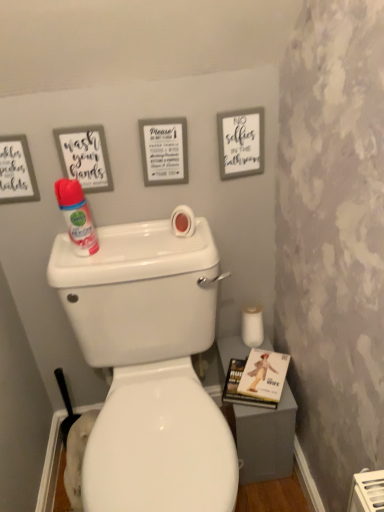
How much space does white matte toilet paper at lower right, which is counted as the 1th toilet paper, starting from the back, occupy vertically?

It is 13.64 centimeters.

Measure the distance between point (x=76, y=242) and camera.

A distance of 1.11 meters exists between point (x=76, y=242) and camera.

You are a GUI agent. You are given a task and a screenshot of the screen. Output one action in this format:
    pyautogui.click(x=<x>, y=<y>)
    Task: Click on the white matte sign at upper right, the first picture frame viewed from the right
    The width and height of the screenshot is (384, 512).
    Given the screenshot: What is the action you would take?
    pyautogui.click(x=241, y=143)

This screenshot has height=512, width=384. Describe the element at coordinates (256, 379) in the screenshot. I see `hardcover book at lower right` at that location.

Measure the distance between point (146, 157) and camera.

They are 3.68 feet apart.

This screenshot has height=512, width=384. I want to click on white matte toilet paper at lower right, the 1th toilet paper ordered from the bottom, so click(252, 326).

Between point (155, 179) and point (249, 149), which one is positioned in front?

The point (249, 149) is closer to the camera.

Can you see matte white sign at upper center, which is the second picture frame from right to left, touching white matte sign at upper right, the 3th picture frame positioned from the left?

matte white sign at upper center, which is the second picture frame from right to left, and white matte sign at upper right, the 3th picture frame positioned from the left, are not in contact.

Considering the relative sizes of matte white sign at upper center, arranged as the second picture frame when viewed from the left, and white matte sign at upper right, the first picture frame viewed from the right, in the image provided, is matte white sign at upper center, arranged as the second picture frame when viewed from the left, bigger than white matte sign at upper right, the first picture frame viewed from the right,?

Yes, matte white sign at upper center, arranged as the second picture frame when viewed from the left, is bigger than white matte sign at upper right, the first picture frame viewed from the right.

How many degrees apart are the facing directions of matte white sign at upper center, which is the second picture frame from right to left, and white matte sign at upper right, the first picture frame viewed from the right?

The facing directions of matte white sign at upper center, which is the second picture frame from right to left, and white matte sign at upper right, the first picture frame viewed from the right, are 0.133 degrees apart.

Is matte pink spray bottle at left looking in the opposite direction of pink matte toilet paper at upper center, which is counted as the first toilet paper, starting from the front?

No, matte pink spray bottle at left's orientation is not away from pink matte toilet paper at upper center, which is counted as the first toilet paper, starting from the front.

From a real-world perspective, is matte pink spray bottle at left located beneath pink matte toilet paper at upper center, marked as the 2th toilet paper in a right-to-left arrangement?

No, from a real-world perspective, matte pink spray bottle at left is not below pink matte toilet paper at upper center, marked as the 2th toilet paper in a right-to-left arrangement.

Does matte pink spray bottle at left touch pink matte toilet paper at upper center, marked as the second toilet paper in a bottom-to-top arrangement?

No, matte pink spray bottle at left is not touching pink matte toilet paper at upper center, marked as the second toilet paper in a bottom-to-top arrangement.

Considering the relative sizes of matte pink spray bottle at left and pink matte toilet paper at upper center, marked as the second toilet paper in a bottom-to-top arrangement, in the image provided, is matte pink spray bottle at left shorter than pink matte toilet paper at upper center, marked as the second toilet paper in a bottom-to-top arrangement,?

In fact, matte pink spray bottle at left may be taller than pink matte toilet paper at upper center, marked as the second toilet paper in a bottom-to-top arrangement.

Which object is wider, matte gray picture frame at upper left, positioned as the third picture frame in right-to-left order, or matte white sign at upper center, arranged as the second picture frame when viewed from the left?

Wider between the two is matte white sign at upper center, arranged as the second picture frame when viewed from the left.

Between matte gray picture frame at upper left, which appears as the first picture frame when viewed from the left, and matte white sign at upper center, which is the second picture frame from right to left, which one appears on the left side from the viewer's perspective?

From the viewer's perspective, matte gray picture frame at upper left, which appears as the first picture frame when viewed from the left, appears more on the left side.

From a real-world perspective, which is physically below, matte gray picture frame at upper left, which appears as the first picture frame when viewed from the left, or matte white sign at upper center, arranged as the second picture frame when viewed from the left?

matte white sign at upper center, arranged as the second picture frame when viewed from the left, from a real-world perspective.

Which is more to the right, white glossy toilet at center or white matte sign at upper right, the 3th picture frame positioned from the left?

From the viewer's perspective, white matte sign at upper right, the 3th picture frame positioned from the left, appears more on the right side.

From a real-world perspective, is white glossy toilet at center physically below white matte sign at upper right, the 3th picture frame positioned from the left?

Correct, in the physical world, white glossy toilet at center is lower than white matte sign at upper right, the 3th picture frame positioned from the left.

Would you say white glossy toilet at center is outside white matte sign at upper right, the first picture frame viewed from the right?

Yes, white glossy toilet at center is outside of white matte sign at upper right, the first picture frame viewed from the right.

Is white glossy toilet at center positioned far away from white matte sign at upper right, the first picture frame viewed from the right?

No, white glossy toilet at center is not far away from white matte sign at upper right, the first picture frame viewed from the right.

From the image's perspective, is matte white sign at upper center, which is the second picture frame from right to left, above or below pink matte toilet paper at upper center, marked as the 2th toilet paper in a right-to-left arrangement?

matte white sign at upper center, which is the second picture frame from right to left, is situated higher than pink matte toilet paper at upper center, marked as the 2th toilet paper in a right-to-left arrangement, in the image.

Is matte white sign at upper center, which is the second picture frame from right to left, not near pink matte toilet paper at upper center, which is counted as the second toilet paper, starting from the back?

They are positioned close to each other.

Does matte white sign at upper center, arranged as the second picture frame when viewed from the left, have a larger size compared to pink matte toilet paper at upper center, which is counted as the first toilet paper, starting from the front?

Correct, matte white sign at upper center, arranged as the second picture frame when viewed from the left, is larger in size than pink matte toilet paper at upper center, which is counted as the first toilet paper, starting from the front.

Does matte white sign at upper center, which is the second picture frame from right to left, appear on the left side of pink matte toilet paper at upper center, arranged as the 1th toilet paper when viewed from the top?

Correct, you'll find matte white sign at upper center, which is the second picture frame from right to left, to the left of pink matte toilet paper at upper center, arranged as the 1th toilet paper when viewed from the top.

How different are the orientations of white matte toilet paper at lower right, which is counted as the 1th toilet paper, starting from the back, and white matte sign at upper right, the first picture frame viewed from the right, in degrees?

The facing directions of white matte toilet paper at lower right, which is counted as the 1th toilet paper, starting from the back, and white matte sign at upper right, the first picture frame viewed from the right, are 1.58 degrees apart.

Considering the sizes of objects white matte toilet paper at lower right, which appears as the 2th toilet paper when viewed from the left, and white matte sign at upper right, the first picture frame viewed from the right, in the image provided, who is bigger, white matte toilet paper at lower right, which appears as the 2th toilet paper when viewed from the left, or white matte sign at upper right, the first picture frame viewed from the right,?

white matte toilet paper at lower right, which appears as the 2th toilet paper when viewed from the left, is bigger.

From a real-world perspective, which is physically below, white matte toilet paper at lower right, placed as the 1th toilet paper when sorted from right to left, or white matte sign at upper right, the first picture frame viewed from the right?

white matte toilet paper at lower right, placed as the 1th toilet paper when sorted from right to left.

In terms of width, does white matte toilet paper at lower right, placed as the 1th toilet paper when sorted from right to left, look wider or thinner when compared to white matte sign at upper right, the 3th picture frame positioned from the left?

white matte toilet paper at lower right, placed as the 1th toilet paper when sorted from right to left, is wider than white matte sign at upper right, the 3th picture frame positioned from the left.

In the scene shown: From the image's perspective, is matte white sign at upper center, which is the second picture frame from right to left, below white glossy toilet at center?

No, from the image's perspective, matte white sign at upper center, which is the second picture frame from right to left, is not beneath white glossy toilet at center.

Does matte white sign at upper center, arranged as the second picture frame when viewed from the left, have a larger size compared to white glossy toilet at center?

No, matte white sign at upper center, arranged as the second picture frame when viewed from the left, is not bigger than white glossy toilet at center.

Which is in front, matte white sign at upper center, arranged as the second picture frame when viewed from the left, or white glossy toilet at center?

white glossy toilet at center is closer to the camera.

This screenshot has width=384, height=512. In order to click on the 1st picture frame above the white matte sign at upper right, the 3th picture frame positioned from the left (from a real-world perspective) in this screenshot , I will do `click(164, 151)`.

Locate an element on the screen. The image size is (384, 512). cleaning product that is in front of the pink matte toilet paper at upper center, marked as the 2th toilet paper in a right-to-left arrangement is located at coordinates (76, 216).

When comparing their distances from matte gray picture frame at upper left, which appears as the first picture frame when viewed from the left, does hardcover book at lower right or white matte sign at upper right, the 3th picture frame positioned from the left, seem closer?

white matte sign at upper right, the 3th picture frame positioned from the left, is closer to matte gray picture frame at upper left, which appears as the first picture frame when viewed from the left.

Based on their spatial positions, is white matte sign at upper right, the 3th picture frame positioned from the left, or matte gray picture frame at upper left, positioned as the third picture frame in right-to-left order, closer to white matte toilet paper at lower right, the 1th toilet paper ordered from the bottom?

white matte sign at upper right, the 3th picture frame positioned from the left, lies closer to white matte toilet paper at lower right, the 1th toilet paper ordered from the bottom, than the other object.

When comparing their distances from matte white sign at upper center, arranged as the second picture frame when viewed from the left, does white glossy toilet at center or white matte sign at upper right, the 3th picture frame positioned from the left, seem closer?

white matte sign at upper right, the 3th picture frame positioned from the left, is positioned closer to the anchor matte white sign at upper center, arranged as the second picture frame when viewed from the left.

Looking at the image, which one is located further to matte pink spray bottle at left, white matte toilet paper at lower right, which is the second toilet paper in front-to-back order, or matte white sign at upper center, arranged as the second picture frame when viewed from the left?

white matte toilet paper at lower right, which is the second toilet paper in front-to-back order.

Looking at the image, which one is located closer to matte white sign at upper center, which is the second picture frame from right to left, matte gray picture frame at upper left, positioned as the third picture frame in right-to-left order, or white glossy toilet at center?

matte gray picture frame at upper left, positioned as the third picture frame in right-to-left order, lies closer to matte white sign at upper center, which is the second picture frame from right to left, than the other object.

Considering their positions, is matte white sign at upper center, arranged as the second picture frame when viewed from the left, positioned further to hardcover book at lower right than matte pink spray bottle at left?

matte white sign at upper center, arranged as the second picture frame when viewed from the left, is positioned further to the anchor hardcover book at lower right.

Which object lies nearer to the anchor point hardcover book at lower right, white matte toilet paper at lower right, which is counted as the 1th toilet paper, starting from the back, or matte white sign at upper center, arranged as the second picture frame when viewed from the left?

Among the two, white matte toilet paper at lower right, which is counted as the 1th toilet paper, starting from the back, is located nearer to hardcover book at lower right.

Estimate the real-world distances between objects in this image. Which object is closer to hardcover book at lower right, white matte sign at upper right, the first picture frame viewed from the right, or matte gray picture frame at upper left, positioned as the third picture frame in right-to-left order?

white matte sign at upper right, the first picture frame viewed from the right, is positioned closer to the anchor hardcover book at lower right.

Where is `toilet paper that lies between matte gray picture frame at upper left, positioned as the third picture frame in right-to-left order, and white matte toilet paper at lower right, marked as the 2th toilet paper in a top-to-bottom arrangement, from top to bottom`? Image resolution: width=384 pixels, height=512 pixels. toilet paper that lies between matte gray picture frame at upper left, positioned as the third picture frame in right-to-left order, and white matte toilet paper at lower right, marked as the 2th toilet paper in a top-to-bottom arrangement, from top to bottom is located at coordinates (183, 221).

Find the location of `toilet paper located between matte pink spray bottle at left and white matte sign at upper right, the first picture frame viewed from the right, in the left-right direction`. toilet paper located between matte pink spray bottle at left and white matte sign at upper right, the first picture frame viewed from the right, in the left-right direction is located at coordinates (183, 221).

Where is `cleaning product between matte gray picture frame at upper left, positioned as the third picture frame in right-to-left order, and hardcover book at lower right, in the vertical direction`? cleaning product between matte gray picture frame at upper left, positioned as the third picture frame in right-to-left order, and hardcover book at lower right, in the vertical direction is located at coordinates (76, 216).

The width and height of the screenshot is (384, 512). I want to click on magazine that lies between white matte sign at upper right, the first picture frame viewed from the right, and white glossy toilet at center from top to bottom, so click(x=256, y=379).